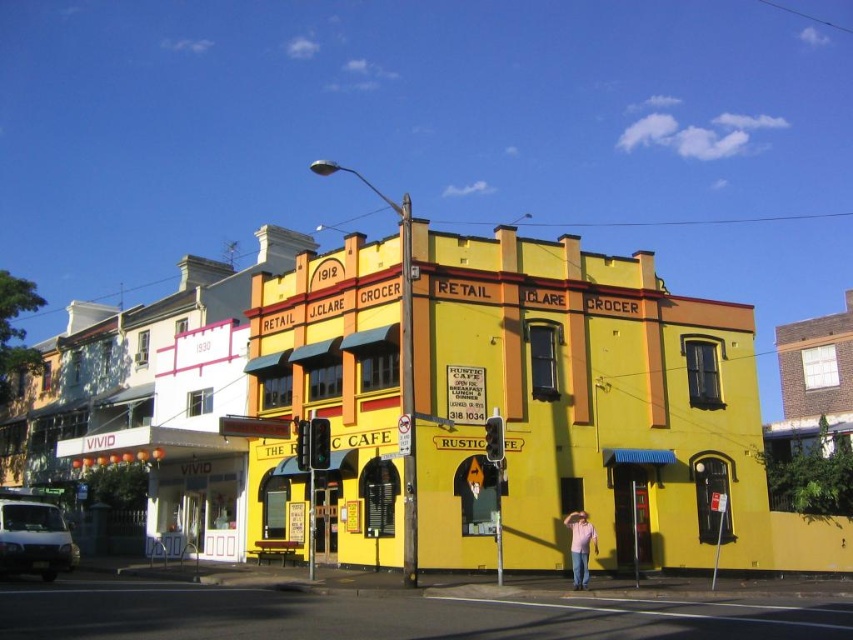
Question: Can you confirm if yellow matte building at center is thinner than pink cotton shirt at lower right?

Choices:
 (A) yes
 (B) no

Answer: (B)

Question: Which of the following is the farthest from the observer?

Choices:
 (A) pink cotton shirt at lower right
 (B) yellow matte building at center

Answer: (B)

Question: Among these objects, which one is nearest to the camera?

Choices:
 (A) yellow matte building at center
 (B) pink cotton shirt at lower right

Answer: (B)

Question: Can you confirm if yellow matte building at center is positioned to the right of pink cotton shirt at lower right?

Choices:
 (A) yes
 (B) no

Answer: (B)

Question: Considering the relative positions of yellow matte building at center and pink cotton shirt at lower right in the image provided, where is yellow matte building at center located with respect to pink cotton shirt at lower right?

Choices:
 (A) left
 (B) right

Answer: (A)

Question: Which of the following is the closest to the observer?

Choices:
 (A) pink cotton shirt at lower right
 (B) yellow matte building at center

Answer: (A)